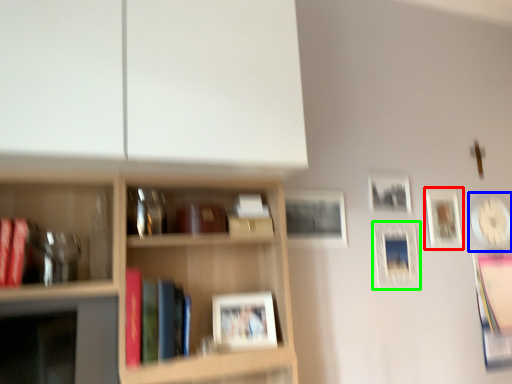
Question: Considering the real-world distances, which object is farthest from picture frame (highlighted by a red box)? picture frame (highlighted by a blue box) or picture frame (highlighted by a green box)?

Choices:
 (A) picture frame
 (B) picture frame

Answer: (B)